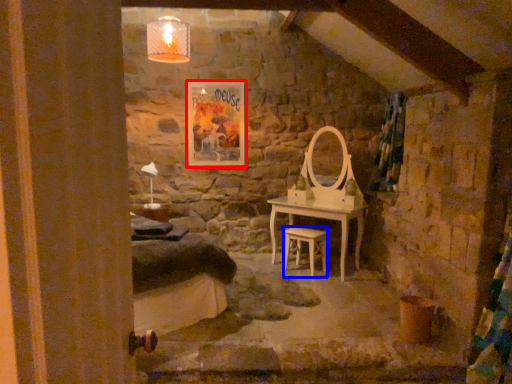
Question: Which object appears farthest to the camera in this image, picture frame (highlighted by a red box) or stool (highlighted by a blue box)?

Choices:
 (A) picture frame
 (B) stool

Answer: (A)